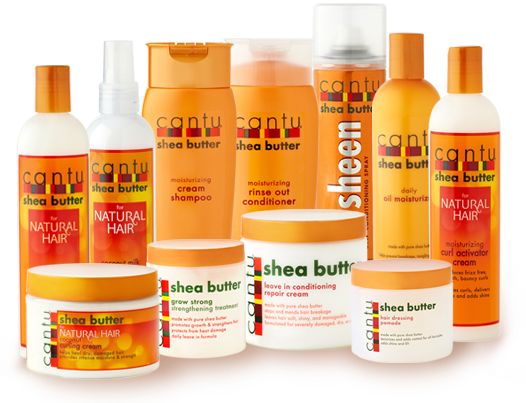
Where is `tubs or jars`? This screenshot has height=403, width=526. tubs or jars is located at coordinates (114, 357), (193, 313), (268, 310), (380, 324).